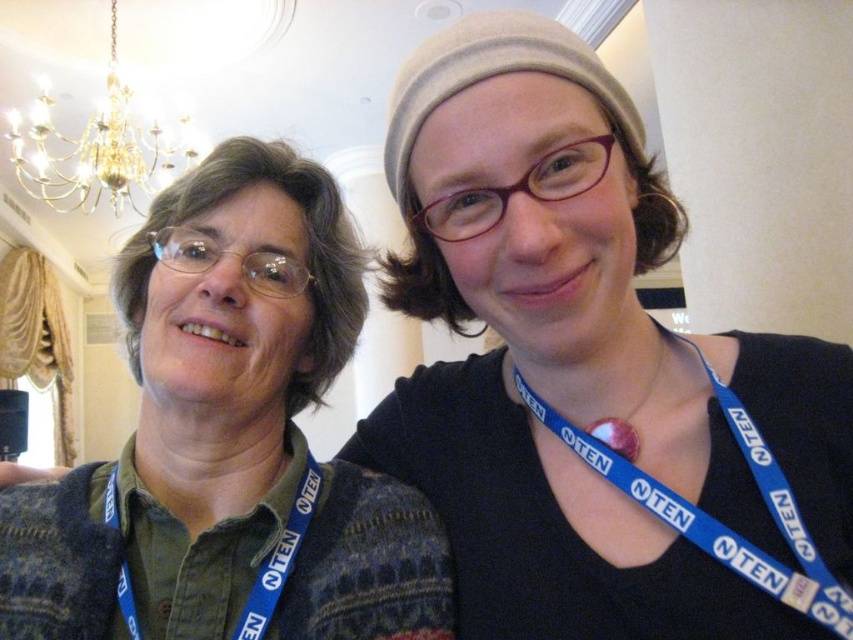
Based on the photo, you are at a conference and want to move from the point marked as point (x=119, y=588) to the point marked as point (x=651, y=385). Given that you can only move forward in a straight line, will you pass through any obstacles between these two points?

Since point (x=119, y=588) is in front of point (x=651, y=385), moving directly between them would mean you are already positioned closer to the destination. However, without additional information about potential obstacles in the path, it is impossible to determine if there are any obstructions between the two points. The spatial relationship provided does not account for objects blocking the path.

You are a photographer at the event and want to capture a photo that includes both the gold metallic chandelier at upper left and the blue fabric lanyard at left. Based on their positions, which object should you ensure is placed to the left side in your camera frame?

The gold metallic chandelier at upper left is positioned on the left side of blue fabric lanyard at left, so you should ensure the gold metallic chandelier at upper left is placed to the left side in your camera frame.

You are at a conference and need to check the name tag of the person wearing the matte blue lanyard at center. Which direction should you look relative to the skinsmoothneck at center?

The skinsmoothneck at center is to the left of the matte blue lanyard at center, so you should look to the right of the skinsmoothneck at center to find the matte blue lanyard at center.